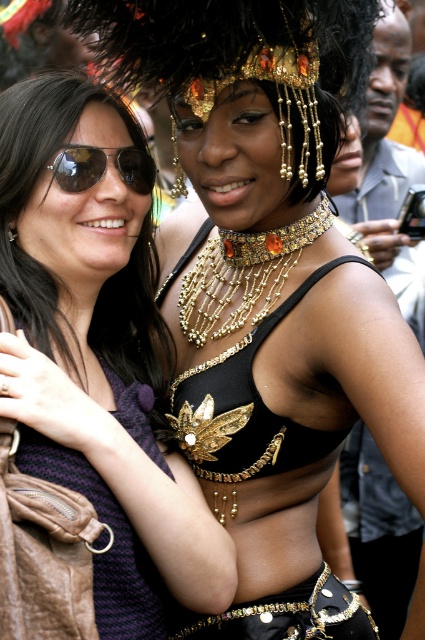
Question: From the image, what is the correct spatial relationship of purple knitted dress at left in relation to shiny black sunglasses at upper left?

Choices:
 (A) left
 (B) right

Answer: (A)

Question: Considering the real-world distances, which object is farthest from the purple knitted dress at left?

Choices:
 (A) shiny black sunglasses at upper left
 (B) sunglasses at left
 (C) gold beaded necklace at center
 (D) gold beaded crown at upper center

Answer: (D)

Question: Which point appears closest to the camera in this image?

Choices:
 (A) (93, 582)
 (B) (132, 316)

Answer: (A)

Question: Is gold beaded crown at upper center wider than gold beaded necklace at center?

Choices:
 (A) yes
 (B) no

Answer: (A)

Question: Does gold beaded crown at upper center have a smaller size compared to sunglasses at left?

Choices:
 (A) yes
 (B) no

Answer: (B)

Question: Which point is closer to the camera?

Choices:
 (A) (251, 294)
 (B) (28, 298)

Answer: (B)